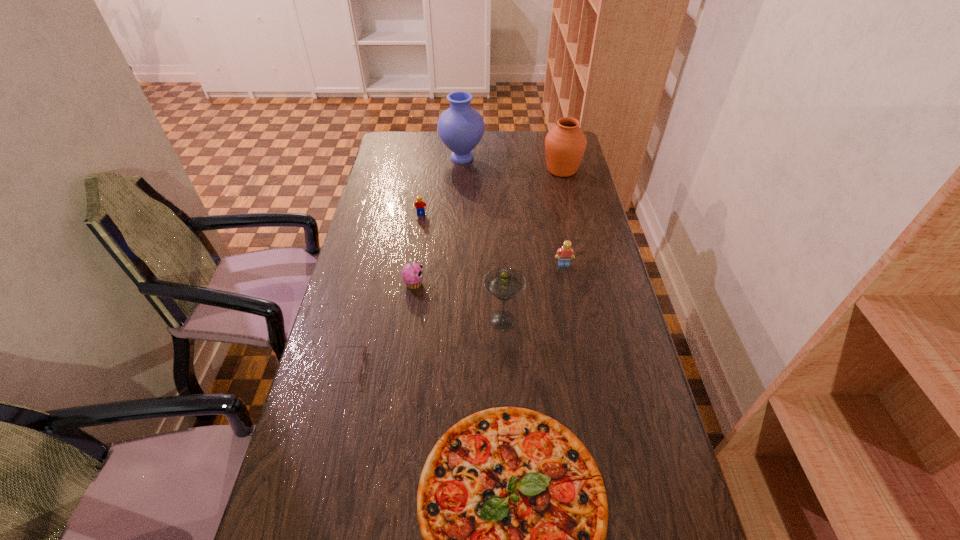
Where is `free space located 0.090m on the left of the vase`? The image size is (960, 540). free space located 0.090m on the left of the vase is located at coordinates (419, 158).

Locate an element on the screen. Image resolution: width=960 pixels, height=540 pixels. vacant region located on the left of the urn is located at coordinates (506, 170).

At what (x,y) coordinates should I click in order to perform the action: click on vacant region located on the front of the martini. Please return your answer as a coordinate pair (x, y). The image size is (960, 540). Looking at the image, I should click on (506, 390).

Find the location of a particular element. free region located on the face of the fourth nearest object is located at coordinates (450, 284).

Find the location of a particular element. This screenshot has height=540, width=960. free space located 0.190m on the front-facing side of the nearer Lego is located at coordinates (572, 312).

I want to click on vacant space situated 0.110m on the front-facing side of the sixth nearest object, so click(418, 235).

This screenshot has width=960, height=540. What are the coordinates of `vacant point located on the face of the sunglasses` in the screenshot? It's located at (386, 368).

The image size is (960, 540). In order to click on object that is at the far edge in this screenshot , I will do (460, 127).

Identify the location of object that is at the left edge. (364, 350).

The image size is (960, 540). What are the coordinates of `urn positioned at the right edge` in the screenshot? It's located at (565, 144).